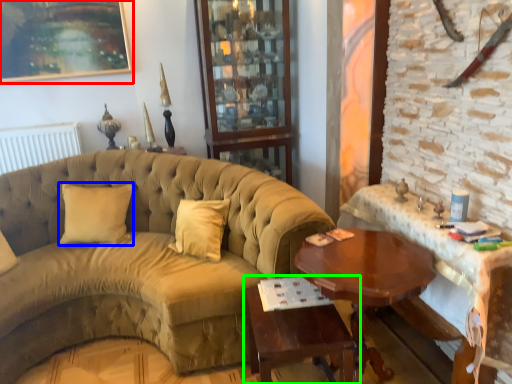
Question: Considering the real-world distances, which object is farthest from picture frame (highlighted by a red box)? pillow (highlighted by a blue box) or table (highlighted by a green box)?

Choices:
 (A) pillow
 (B) table

Answer: (B)